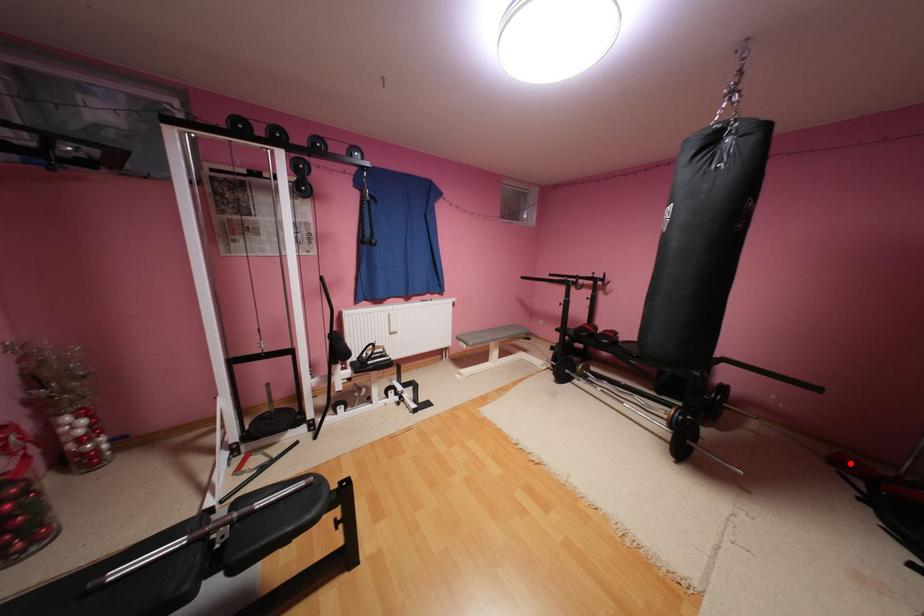
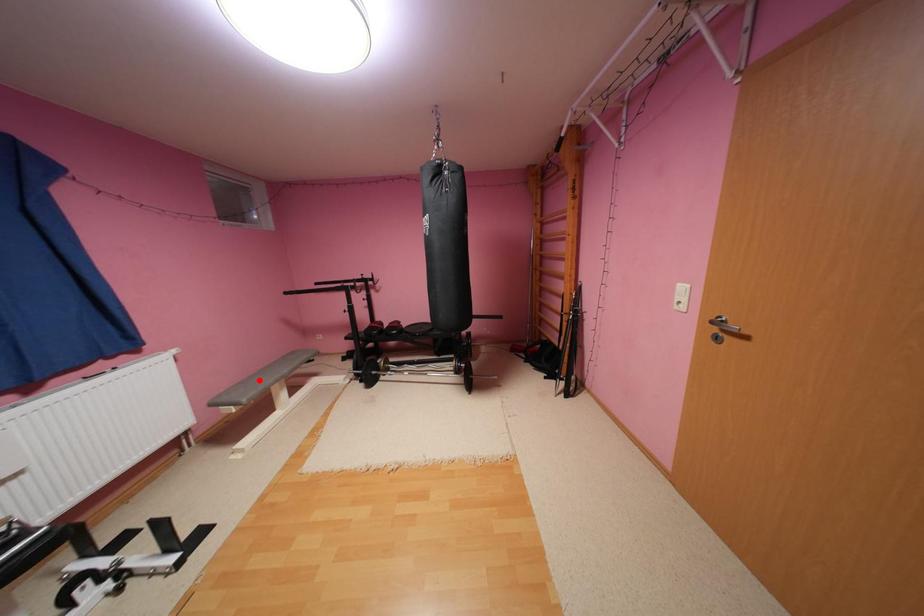
I am providing you with two images of the same scene from different viewpoints. A red point is marked on the first image and another point is marked on the second image. Do the highlighted points in image1 and image2 indicate the same real-world spot?

No